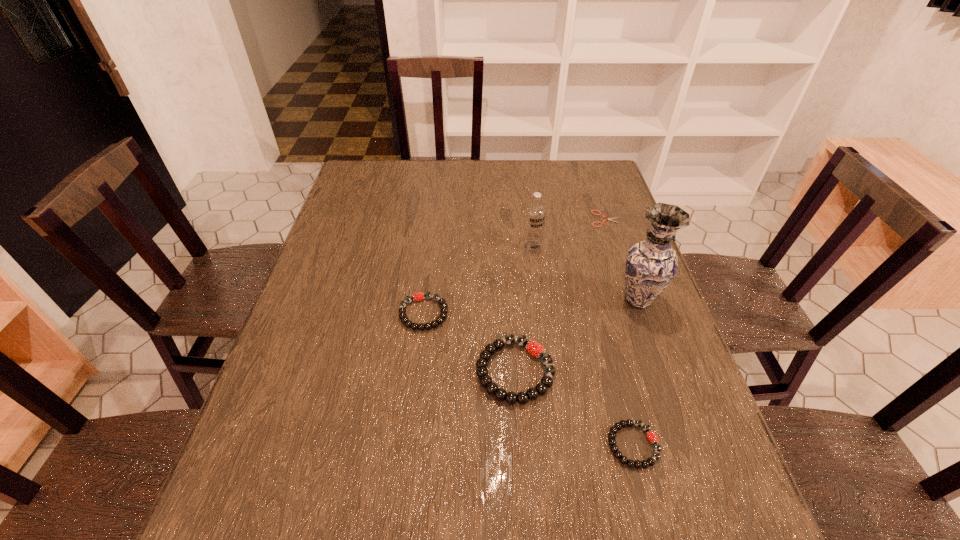
Locate an element on the screen. The image size is (960, 540). vacant area between the second tallest bracelet and the second bracelet from right to left is located at coordinates (469, 342).

You are a GUI agent. You are given a task and a screenshot of the screen. Output one action in this format:
    pyautogui.click(x=<x>, y=<y>)
    Task: Click on the free point between the leftmost object and the vase
    The height and width of the screenshot is (540, 960).
    Given the screenshot: What is the action you would take?
    pyautogui.click(x=531, y=307)

At what (x,y) coordinates should I click in order to perform the action: click on vacant area that lies between the fifth farthest object and the nearest bracelet. Please return your answer as a coordinate pair (x, y). This screenshot has height=540, width=960. Looking at the image, I should click on (574, 408).

Locate an element on the screen. Image resolution: width=960 pixels, height=540 pixels. free space that is in between the shears and the leftmost bracelet is located at coordinates (515, 266).

Identify the location of free spot between the nearest object and the second nearest object. (574, 408).

Where is `vacant space that is in between the shears and the fifth nearest object`? vacant space that is in between the shears and the fifth nearest object is located at coordinates (568, 232).

Identify the location of vacant space in between the second nearest bracelet and the shortest object. (561, 295).

Where is `unoccupied area between the leftmost bracelet and the fifth nearest object`? This screenshot has width=960, height=540. unoccupied area between the leftmost bracelet and the fifth nearest object is located at coordinates (478, 280).

You are a GUI agent. You are given a task and a screenshot of the screen. Output one action in this format:
    pyautogui.click(x=<x>, y=<y>)
    Task: Click on the free spot between the tallest object and the fifth farthest object
    This screenshot has height=540, width=960.
    Given the screenshot: What is the action you would take?
    pyautogui.click(x=577, y=336)

At what (x,y) coordinates should I click in order to perform the action: click on object that stands as the second closest to the leftmost object. Please return your answer as a coordinate pair (x, y). This screenshot has height=540, width=960. Looking at the image, I should click on (535, 213).